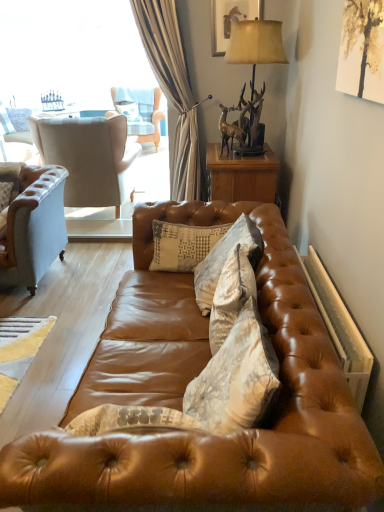
Question: Is metallic gold deer at upper right not close to shiny brown leather couch at center?

Choices:
 (A) no
 (B) yes

Answer: (B)

Question: Is metallic gold deer at upper right taller than shiny brown leather couch at center?

Choices:
 (A) yes
 (B) no

Answer: (B)

Question: From the image's perspective, is metallic gold deer at upper right above shiny brown leather couch at center?

Choices:
 (A) yes
 (B) no

Answer: (A)

Question: Is metallic gold deer at upper right oriented away from shiny brown leather couch at center?

Choices:
 (A) no
 (B) yes

Answer: (A)

Question: From the image's perspective, is metallic gold deer at upper right beneath shiny brown leather couch at center?

Choices:
 (A) no
 (B) yes

Answer: (A)

Question: Is light blue fabric chair at upper left, which appears as the 2th chair when ordered from the bottom, to the left or to the right of white textured pillow at center, which ranks as the third pillow in right-to-left order, in the image?

Choices:
 (A) right
 (B) left

Answer: (A)

Question: Considering their positions, is light blue fabric chair at upper left, which ranks as the first chair in top-to-bottom order, located in front of or behind white textured pillow at center, which is the 1th pillow from top to bottom?

Choices:
 (A) front
 (B) behind

Answer: (A)

Question: Choose the correct answer: Is light blue fabric chair at upper left, the 1th chair from the back, inside white textured pillow at center, which ranks as the 1th pillow in left-to-right order, or outside it?

Choices:
 (A) inside
 (B) outside

Answer: (B)

Question: Looking at their shapes, would you say light blue fabric chair at upper left, which ranks as the first chair in top-to-bottom order, is wider or thinner than white textured pillow at center, positioned as the third pillow in bottom-to-top order?

Choices:
 (A) wide
 (B) thin

Answer: (A)

Question: From a real-world perspective, is light blue fabric chair at upper left, which appears as the 2th chair when ordered from the bottom, physically located above or below antlered bronze lamp at upper right?

Choices:
 (A) above
 (B) below

Answer: (B)

Question: Does point (145, 102) appear closer or farther from the camera than point (236, 24)?

Choices:
 (A) farther
 (B) closer

Answer: (A)

Question: Is light blue fabric chair at upper left, which appears as the 2th chair when ordered from the bottom, to the left or to the right of antlered bronze lamp at upper right in the image?

Choices:
 (A) right
 (B) left

Answer: (B)

Question: Based on their sizes in the image, would you say light blue fabric chair at upper left, the 1th chair from the back, is bigger or smaller than antlered bronze lamp at upper right?

Choices:
 (A) big
 (B) small

Answer: (A)

Question: Looking at their shapes, would you say textured beige pillow at center, which is counted as the 1th pillow, starting from the bottom, is wider or thinner than shiny brown leather couch at center?

Choices:
 (A) wide
 (B) thin

Answer: (B)

Question: Is textured beige pillow at center, positioned as the 3th pillow in top-to-bottom order, bigger or smaller than shiny brown leather couch at center?

Choices:
 (A) small
 (B) big

Answer: (A)